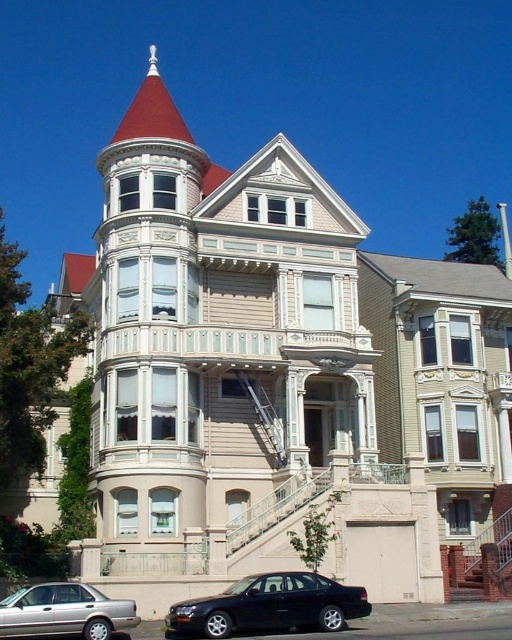
Who is more forward, (364,600) or (90,628)?

Point (90,628)

Is black matte sedan at lower center smaller than silver metallic sedan at lower left?

No.

Measure the distance between black matte sedan at lower center and camera.

black matte sedan at lower center is 117.79 feet from camera.

The width and height of the screenshot is (512, 640). I want to click on black matte sedan at lower center, so click(x=268, y=605).